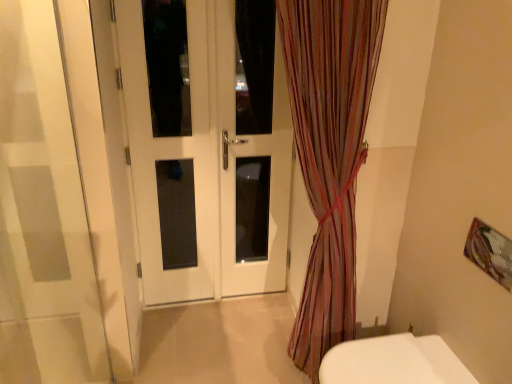
Question: Is white glossy door at center closer to camera compared to metallic silver picture frame at upper right?

Choices:
 (A) yes
 (B) no

Answer: (B)

Question: Is white glossy door at center taller than metallic silver picture frame at upper right?

Choices:
 (A) no
 (B) yes

Answer: (B)

Question: Is white glossy door at center not close to metallic silver picture frame at upper right?

Choices:
 (A) yes
 (B) no

Answer: (A)

Question: Does white glossy door at center lie behind metallic silver picture frame at upper right?

Choices:
 (A) no
 (B) yes

Answer: (B)

Question: From a real-world perspective, is white glossy door at center positioned under metallic silver picture frame at upper right based on gravity?

Choices:
 (A) no
 (B) yes

Answer: (B)

Question: From a real-world perspective, relative to striped sheer curtain at center, is white glass door at center vertically above or below?

Choices:
 (A) below
 (B) above

Answer: (B)

Question: Is white glass door at center in front of or behind striped sheer curtain at center in the image?

Choices:
 (A) behind
 (B) front

Answer: (A)

Question: In terms of width, does white glass door at center look wider or thinner when compared to striped sheer curtain at center?

Choices:
 (A) wide
 (B) thin

Answer: (B)

Question: From their relative heights in the image, would you say white glass door at center is taller or shorter than striped sheer curtain at center?

Choices:
 (A) tall
 (B) short

Answer: (B)

Question: From the image's perspective, is white glossy toilet at lower right above or below metallic silver picture frame at upper right?

Choices:
 (A) above
 (B) below

Answer: (B)

Question: Choose the correct answer: Is white glossy toilet at lower right inside metallic silver picture frame at upper right or outside it?

Choices:
 (A) outside
 (B) inside

Answer: (A)

Question: Is white glossy toilet at lower right taller or shorter than metallic silver picture frame at upper right?

Choices:
 (A) short
 (B) tall

Answer: (B)

Question: Considering the relative positions of white glossy toilet at lower right and metallic silver picture frame at upper right in the image provided, is white glossy toilet at lower right to the left or to the right of metallic silver picture frame at upper right?

Choices:
 (A) left
 (B) right

Answer: (A)

Question: Is metallic silver picture frame at upper right taller or shorter than striped sheer curtain at center?

Choices:
 (A) short
 (B) tall

Answer: (A)

Question: In terms of width, does metallic silver picture frame at upper right look wider or thinner when compared to striped sheer curtain at center?

Choices:
 (A) thin
 (B) wide

Answer: (A)